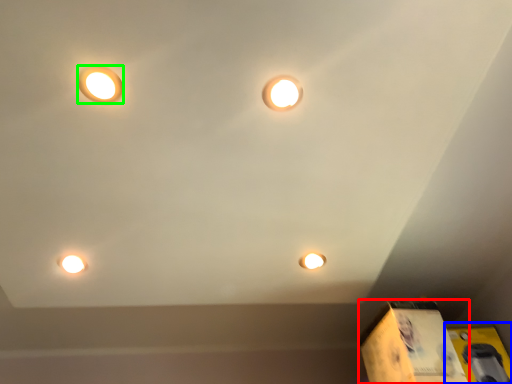
Question: Which object is positioned closest to cardboard box (highlighted by a red box)? Select from cardboard box (highlighted by a blue box) and lamp (highlighted by a green box).

Choices:
 (A) cardboard box
 (B) lamp

Answer: (A)